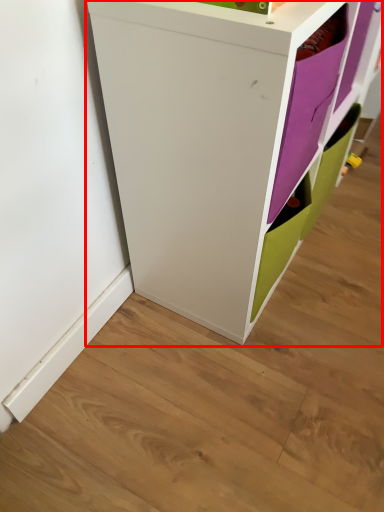
Question: From the image's perspective, where is cupboard (annotated by the red box) located relative to shelf?

Choices:
 (A) below
 (B) above

Answer: (B)